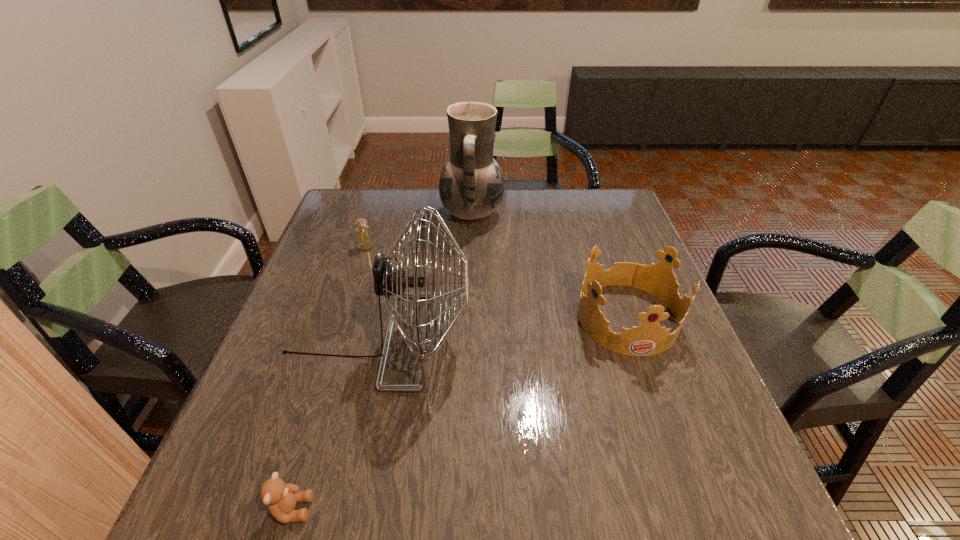
Locate an element on the screen. free location located on the front-facing side of the nearest object is located at coordinates (430, 509).

Identify the location of object that is at the far edge. This screenshot has width=960, height=540. (471, 185).

Locate an element on the screen. The height and width of the screenshot is (540, 960). object that is at the near edge is located at coordinates (281, 498).

Locate an element on the screen. The image size is (960, 540). fan that is positioned at the left edge is located at coordinates (389, 282).

Locate an element on the screen. The height and width of the screenshot is (540, 960). saltshaker at the left edge is located at coordinates click(364, 241).

You are a GUI agent. You are given a task and a screenshot of the screen. Output one action in this format:
    pyautogui.click(x=<x>, y=<y>)
    Task: Click on the teddy bear that is positioned at the left edge
    The image size is (960, 540).
    Given the screenshot: What is the action you would take?
    pyautogui.click(x=281, y=498)

Find the location of `object that is at the right edge`. object that is at the right edge is located at coordinates (648, 339).

Locate an element on the screen. object located at the near left corner is located at coordinates (281, 498).

The width and height of the screenshot is (960, 540). I want to click on free space at the far edge of the desktop, so click(513, 221).

Locate an element on the screen. The width and height of the screenshot is (960, 540). free space at the near edge of the desktop is located at coordinates (408, 507).